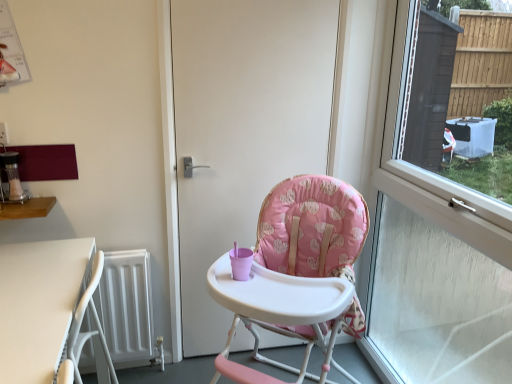
Question: Can you confirm if transparent glass window at right is smaller than white matte radiator at lower left?

Choices:
 (A) yes
 (B) no

Answer: (B)

Question: Is transparent glass window at right in contact with white matte radiator at lower left?

Choices:
 (A) no
 (B) yes

Answer: (A)

Question: Is transparent glass window at right not near white matte radiator at lower left?

Choices:
 (A) no
 (B) yes

Answer: (B)

Question: Considering the relative sizes of transparent glass window at right and white matte radiator at lower left in the image provided, is transparent glass window at right bigger than white matte radiator at lower left?

Choices:
 (A) no
 (B) yes

Answer: (B)

Question: Does transparent glass window at right have a lesser height compared to white matte radiator at lower left?

Choices:
 (A) no
 (B) yes

Answer: (A)

Question: From the image's perspective, is transparent glass window at right on top of white matte radiator at lower left?

Choices:
 (A) no
 (B) yes

Answer: (B)

Question: Can you confirm if white plastic table at lower left, the 2th table when ordered from top to bottom, is shorter than wooden table at left, the 2th table when ordered from bottom to top?

Choices:
 (A) yes
 (B) no

Answer: (B)

Question: Can you confirm if white plastic table at lower left, the 1th table ordered from the bottom, is smaller than wooden table at left, the 2th table when ordered from bottom to top?

Choices:
 (A) yes
 (B) no

Answer: (B)

Question: Is white plastic table at lower left, the 2th table when ordered from top to bottom, far away from wooden table at left, the 2th table when ordered from bottom to top?

Choices:
 (A) yes
 (B) no

Answer: (B)

Question: Can you see white plastic table at lower left, the 1th table ordered from the bottom, touching wooden table at left, the 2th table when ordered from bottom to top?

Choices:
 (A) yes
 (B) no

Answer: (B)

Question: Is white plastic table at lower left, the 2th table when ordered from top to bottom, at the right side of wooden table at left, which ranks as the first table in top-to-bottom order?

Choices:
 (A) no
 (B) yes

Answer: (B)

Question: From the image's perspective, would you say white plastic table at lower left, the 1th table ordered from the bottom, is positioned over wooden table at left, the 2th table when ordered from bottom to top?

Choices:
 (A) no
 (B) yes

Answer: (A)

Question: Does pink fabric highchair at center have a lesser width compared to white matte door at center?

Choices:
 (A) yes
 (B) no

Answer: (B)